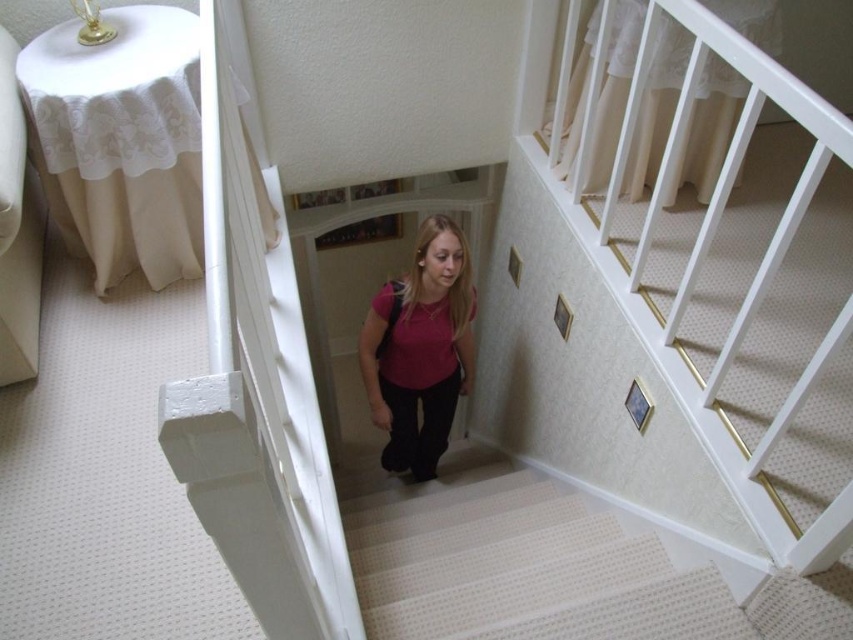
Does white textured carpet at center lie behind matte pink shirt at center?

No, white textured carpet at center is closer to the viewer.

Does white textured carpet at center have a lesser height compared to matte pink shirt at center?

Indeed, white textured carpet at center has a lesser height compared to matte pink shirt at center.

Where is `white textured carpet at center`? white textured carpet at center is located at coordinates (523, 561).